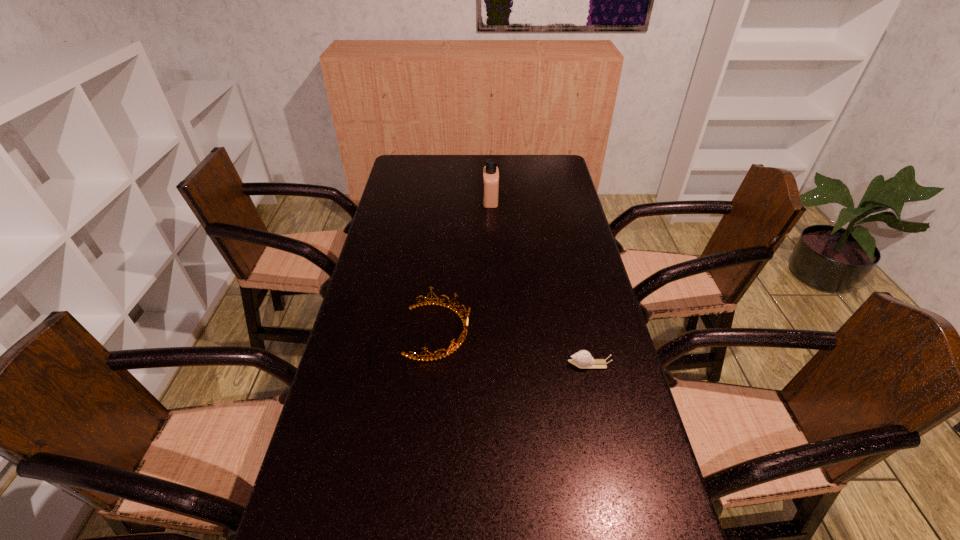
The image size is (960, 540). In order to click on vacant area located on the shell of the shortest object in this screenshot , I will do `click(503, 364)`.

Where is `vacant region located 0.160m on the shell of the shortest object`? The image size is (960, 540). vacant region located 0.160m on the shell of the shortest object is located at coordinates (507, 364).

This screenshot has width=960, height=540. What are the coordinates of `vacant space situated 0.310m on the shell of the shortest object` in the screenshot? It's located at (449, 364).

Identify the location of object located at the right edge. (582, 359).

I want to click on vacant space at the far edge of the desktop, so click(x=517, y=160).

The width and height of the screenshot is (960, 540). Find the location of `vacant space at the left edge of the desktop`. vacant space at the left edge of the desktop is located at coordinates (407, 235).

Image resolution: width=960 pixels, height=540 pixels. Identify the location of vacant position at the right edge of the desktop. (569, 183).

This screenshot has width=960, height=540. What are the coordinates of `free space at the far left corner of the desktop` in the screenshot? It's located at (412, 166).

The image size is (960, 540). Identify the location of free space at the far right corner of the desktop. (534, 176).

The height and width of the screenshot is (540, 960). What are the coordinates of `free area in between the escargot and the leftmost object` in the screenshot? It's located at (514, 348).